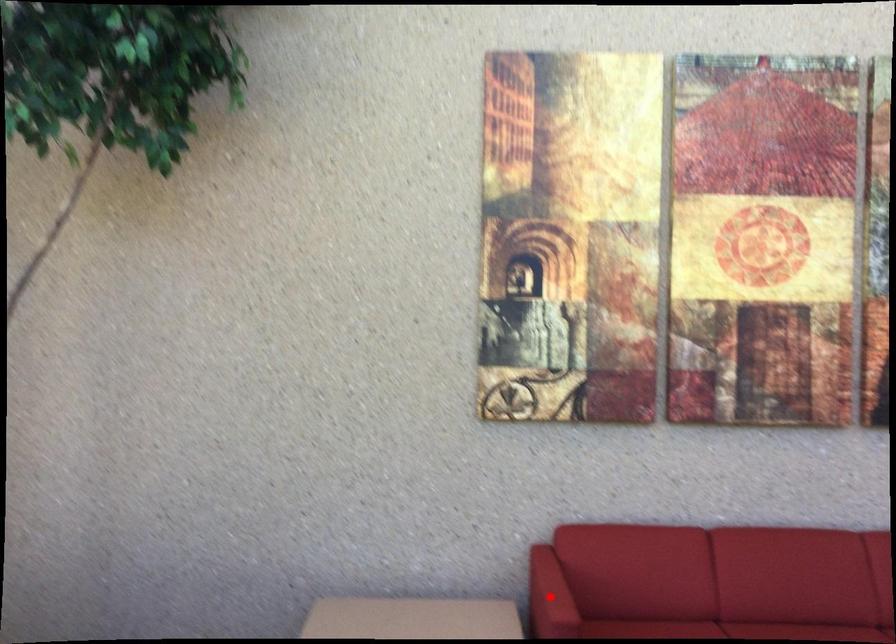
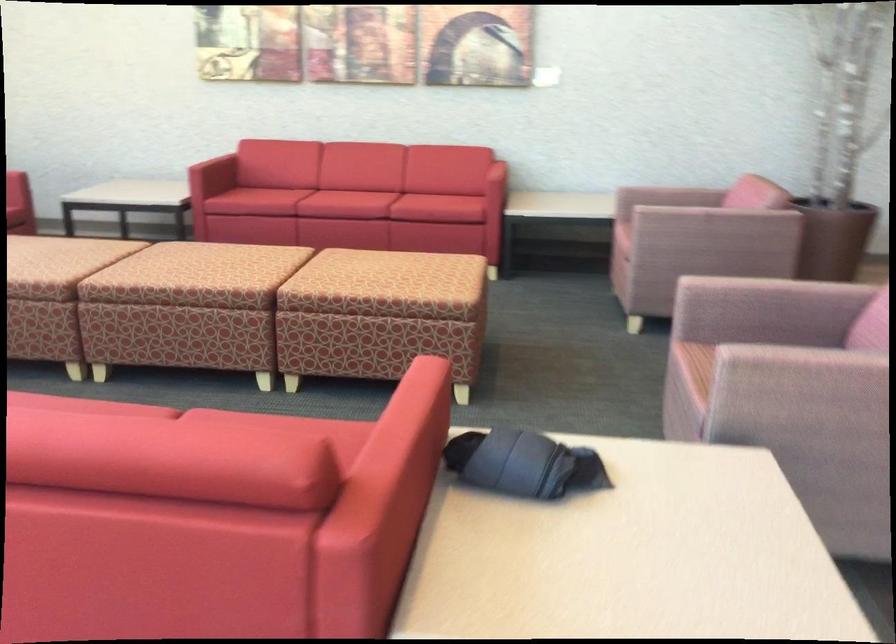
Question: I am providing you with two images of the same scene from different viewpoints. A red point is marked on the first image. Is the red point's position out of view in image 2?

Choices:
 (A) Yes
 (B) No

Answer: (A)